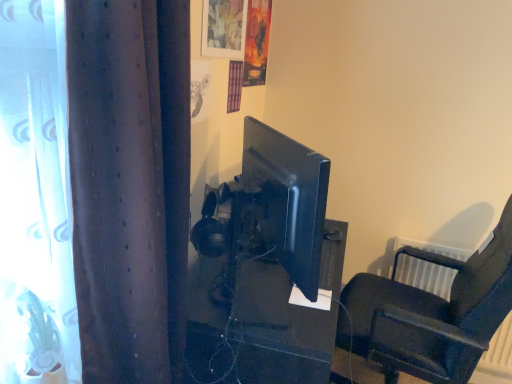
Question: Is brown textured curtain at left positioned beyond the bounds of black leather chair at right?

Choices:
 (A) no
 (B) yes

Answer: (B)

Question: Considering the relative sizes of brown textured curtain at left and black leather chair at right in the image provided, is brown textured curtain at left smaller than black leather chair at right?

Choices:
 (A) no
 (B) yes

Answer: (B)

Question: Does brown textured curtain at left have a larger size compared to black leather chair at right?

Choices:
 (A) no
 (B) yes

Answer: (A)

Question: Considering the relative positions of brown textured curtain at left and black leather chair at right in the image provided, is brown textured curtain at left to the left of black leather chair at right from the viewer's perspective?

Choices:
 (A) yes
 (B) no

Answer: (A)

Question: From a real-world perspective, is brown textured curtain at left on black leather chair at right?

Choices:
 (A) yes
 (B) no

Answer: (A)

Question: Considering their positions, is brown textured curtain at left located in front of or behind satin black monitor at center?

Choices:
 (A) front
 (B) behind

Answer: (A)

Question: Looking at the image, does brown textured curtain at left seem bigger or smaller compared to satin black monitor at center?

Choices:
 (A) big
 (B) small

Answer: (B)

Question: From the image's perspective, is brown textured curtain at left positioned above or below satin black monitor at center?

Choices:
 (A) below
 (B) above

Answer: (B)

Question: Is point (151, 350) closer or farther from the camera than point (338, 236)?

Choices:
 (A) closer
 (B) farther

Answer: (A)

Question: Is point (238, 21) closer or farther from the camera than point (211, 274)?

Choices:
 (A) farther
 (B) closer

Answer: (A)

Question: Would you say matte plastic picture frame at upper center is inside or outside satin black monitor at center?

Choices:
 (A) inside
 (B) outside

Answer: (B)

Question: Considering their positions, is matte plastic picture frame at upper center located in front of or behind satin black monitor at center?

Choices:
 (A) behind
 (B) front

Answer: (A)

Question: Is matte plastic picture frame at upper center wider or thinner than satin black monitor at center?

Choices:
 (A) thin
 (B) wide

Answer: (A)

Question: Do you think brown textured curtain at left is within matte plastic picture frame at upper center, or outside of it?

Choices:
 (A) inside
 (B) outside

Answer: (B)

Question: Is brown textured curtain at left taller or shorter than matte plastic picture frame at upper center?

Choices:
 (A) short
 (B) tall

Answer: (B)